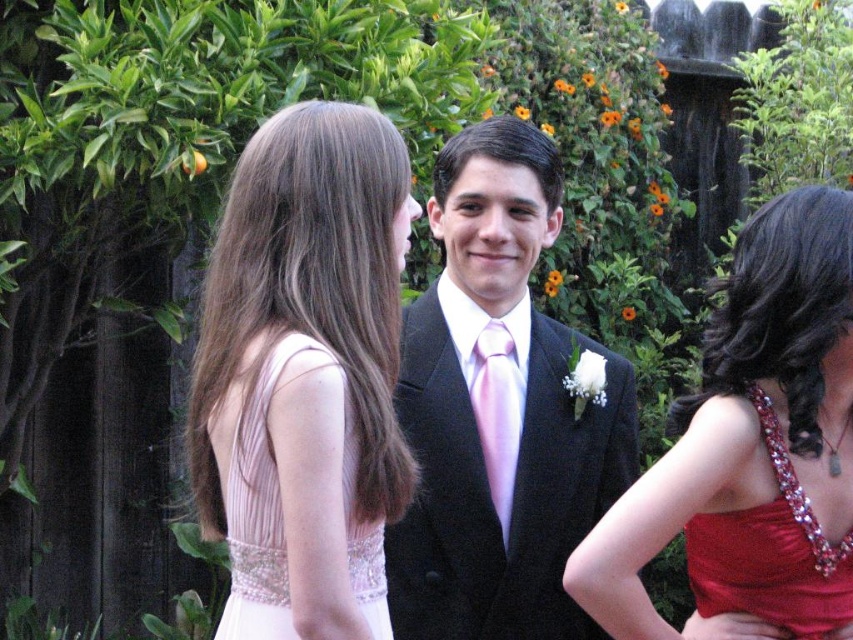
You are a photographer at this event and need to position two subjects wearing pink satin dresses for a group photo. The first is wearing the pink satin dress at upper left and the second the pink satin dress at left. Which of the two dresses is wider?

The pink satin dress at upper left is wider than the pink satin dress at left according to the description.

You are standing in the garden and want to walk from point A to point B. The coordinates for point A are point (438, 298) and point B are point (467, 209). Which point is closer to you?

Point (438, 298) is closer to you than point (467, 209) because it is further to the viewer.